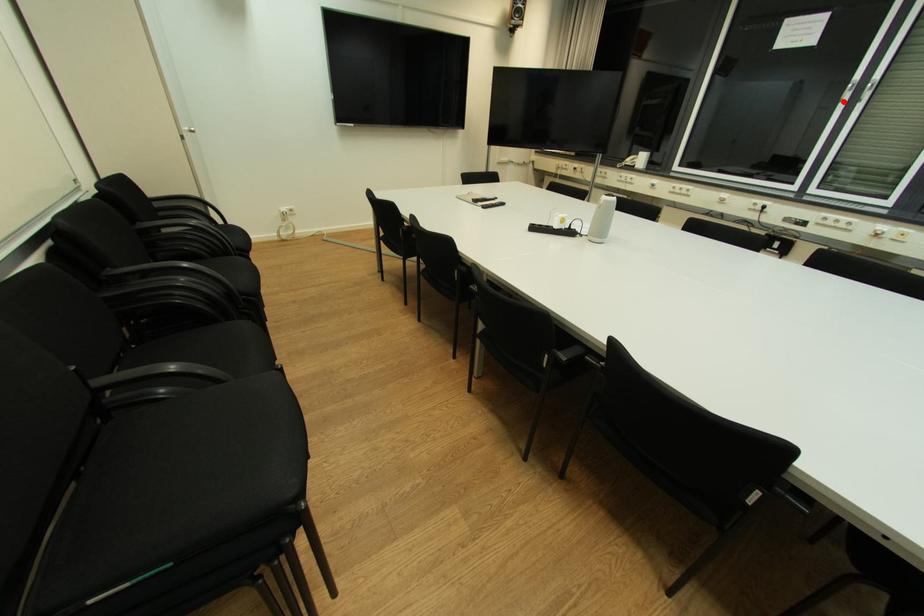
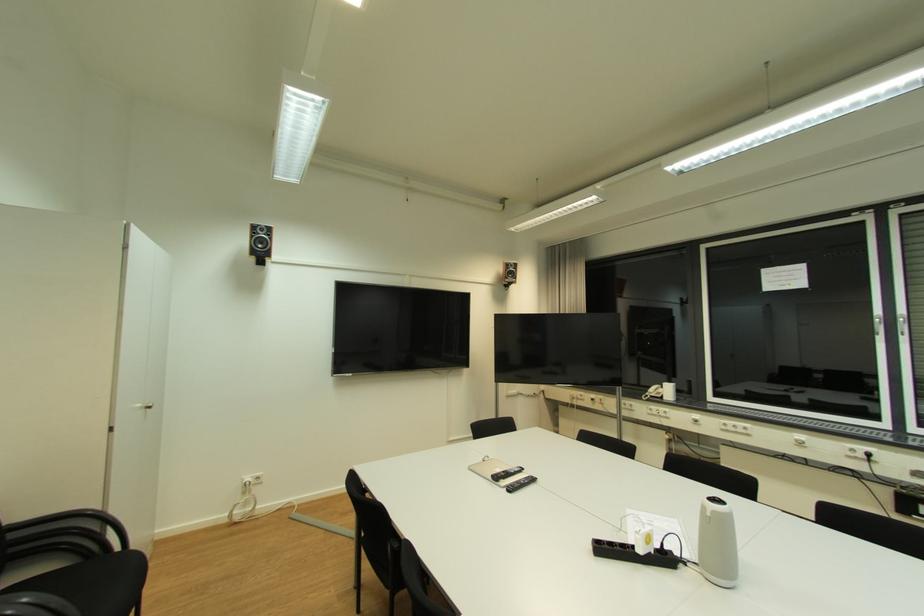
Locate, in the second image, the point that corresponds to the highlighted location in the first image.

(880, 334)